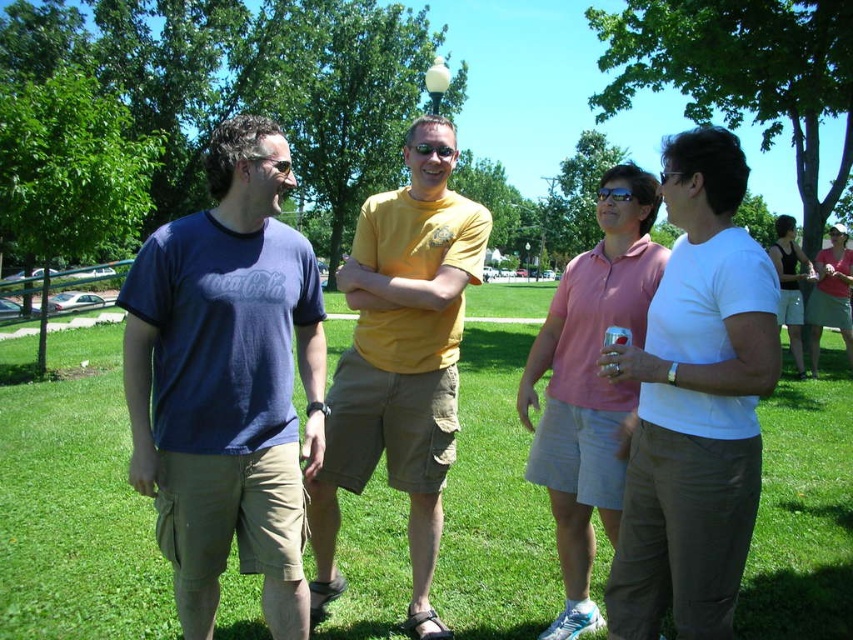
You are planning to hang a picture frame on the wall between the white matte shirt at center and the pink cotton polo shirt at center. Since the frame requires a certain height to fit properly, can you determine which object is taller to ensure proper placement?

The white matte shirt at center is taller than the pink cotton polo shirt at center, so you should position the picture frame above the white matte shirt at center to accommodate its height.